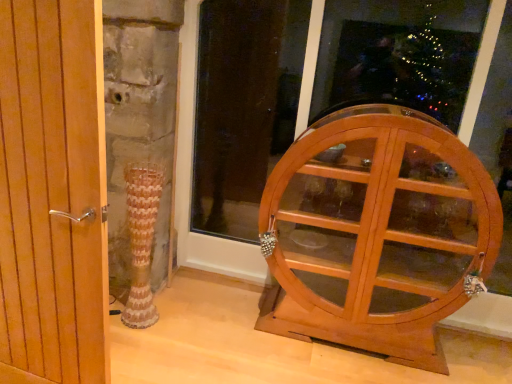
Question: Is wooden door handle at left shorter than wooden cabinet at right?

Choices:
 (A) no
 (B) yes

Answer: (B)

Question: Is wooden door handle at left looking in the opposite direction of wooden cabinet at right?

Choices:
 (A) no
 (B) yes

Answer: (B)

Question: Is wooden door handle at left positioned far away from wooden cabinet at right?

Choices:
 (A) no
 (B) yes

Answer: (B)

Question: Is wooden door handle at left further to camera compared to wooden cabinet at right?

Choices:
 (A) yes
 (B) no

Answer: (B)

Question: From a real-world perspective, is wooden door handle at left located beneath wooden cabinet at right?

Choices:
 (A) no
 (B) yes

Answer: (B)

Question: From the image's perspective, is wooden door handle at left located above or below wooden cabinet at right?

Choices:
 (A) below
 (B) above

Answer: (A)

Question: In terms of height, does wooden door handle at left look taller or shorter compared to wooden cabinet at right?

Choices:
 (A) short
 (B) tall

Answer: (A)

Question: Is point (44, 3) positioned closer to the camera than point (181, 120)?

Choices:
 (A) closer
 (B) farther

Answer: (A)

Question: Which is correct: wooden door handle at left is inside wooden cabinet at right, or outside of it?

Choices:
 (A) outside
 (B) inside

Answer: (A)

Question: In the image, is wooden cabinet at right positioned in front of or behind wooden door handle at left?

Choices:
 (A) behind
 (B) front

Answer: (A)

Question: Looking at their shapes, would you say wooden cabinet at right is wider or thinner than wooden door handle at left?

Choices:
 (A) thin
 (B) wide

Answer: (B)

Question: Looking at the image, does wooden cabinet at right seem bigger or smaller compared to wooden door handle at left?

Choices:
 (A) big
 (B) small

Answer: (A)

Question: Is point (500, 13) closer or farther from the camera than point (65, 316)?

Choices:
 (A) closer
 (B) farther

Answer: (B)

Question: Is point pyautogui.click(x=410, y=364) closer or farther from the camera than point pyautogui.click(x=99, y=249)?

Choices:
 (A) farther
 (B) closer

Answer: (A)

Question: Which is correct: light brown wooden cabinet at right is inside wooden door handle at left, or outside of it?

Choices:
 (A) inside
 (B) outside

Answer: (B)